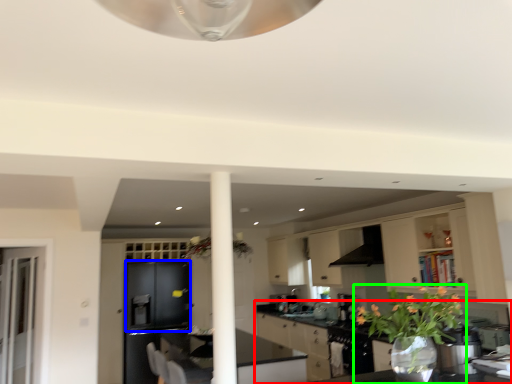
Question: Which object is the closest to the countertop (highlighted by a red box)? Choose among these: cabinetry (highlighted by a blue box) or houseplant (highlighted by a green box).

Choices:
 (A) cabinetry
 (B) houseplant

Answer: (A)